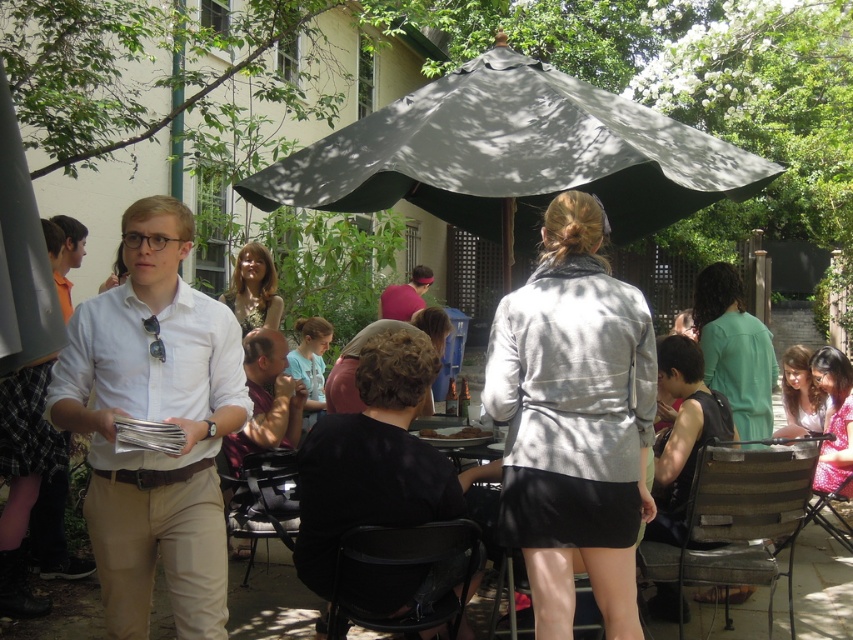
Question: Is black matte dress at center thinner than blonde hair at center?

Choices:
 (A) no
 (B) yes

Answer: (A)

Question: Which point is farther to the camera?

Choices:
 (A) (833, 400)
 (B) (554, 266)
 (C) (146, 243)

Answer: (A)

Question: Among these points, which one is nearest to the camera?

Choices:
 (A) (137, 296)
 (B) (492, 324)

Answer: (A)

Question: Which of the following is the closest to the observer?

Choices:
 (A) pos(787,358)
 (B) pos(625,374)
 (C) pos(390,205)

Answer: (B)

Question: Does white matte shirt at center come in front of black matte dress at center?

Choices:
 (A) yes
 (B) no

Answer: (A)

Question: Does shiny pink fabric at lower right have a greater width compared to curly hair at center?

Choices:
 (A) yes
 (B) no

Answer: (A)